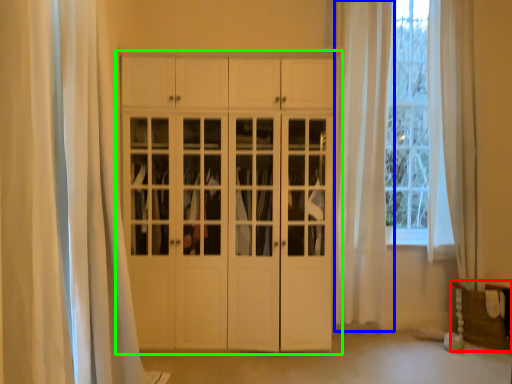
Question: Which is nearer to the furniture (highlighted by a red box)? curtain (highlighted by a blue box) or cupboard (highlighted by a green box).

Choices:
 (A) curtain
 (B) cupboard

Answer: (A)